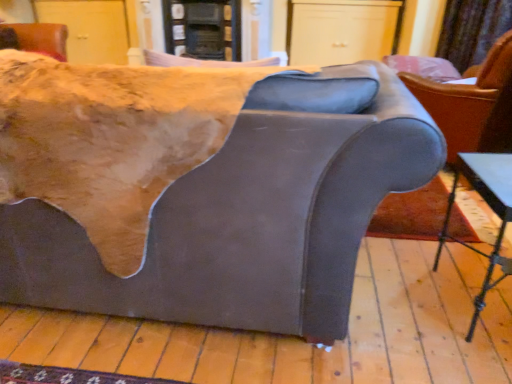
This screenshot has height=384, width=512. Identify the location of free space underneath metallic silver table at lower right (from a real-world perspective). (486, 301).